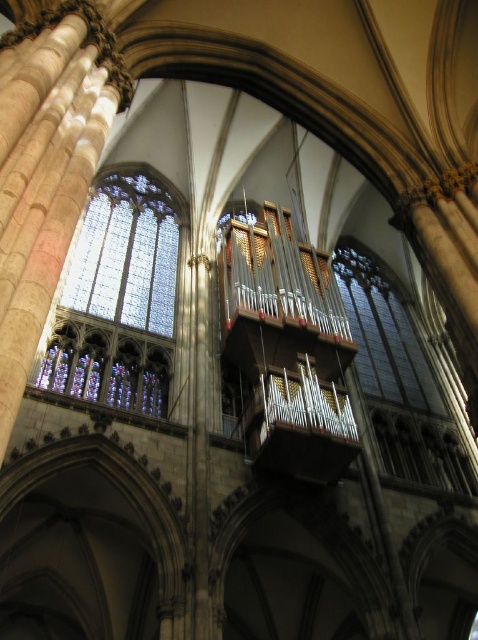
Can you confirm if metallic pipes at center is thinner than clear glass window at center?

No.

Between metallic pipes at center and clear glass window at center, which one has more height?

With more height is metallic pipes at center.

Which is behind, point (257, 460) or point (366, 369)?

Point (366, 369)

Locate an element on the screen. The image size is (478, 640). metallic pipes at center is located at coordinates (288, 348).

Who is positioned more to the right, stained glass at center or clear glass window at center?

Positioned to the right is clear glass window at center.

Can you confirm if stained glass at center is positioned above clear glass window at center?

Indeed, stained glass at center is positioned over clear glass window at center.

Where is `stained glass at center`? stained glass at center is located at coordinates (127, 256).

From the picture: Is metallic pipes at center closer to the viewer compared to stained glass at center?

Yes, it is in front of stained glass at center.

Between metallic pipes at center and stained glass at center, which one is positioned lower?

metallic pipes at center is below.

Is point (295, 401) positioned in front of point (132, 250)?

That is True.

This screenshot has height=640, width=478. I want to click on metallic pipes at center, so click(x=288, y=348).